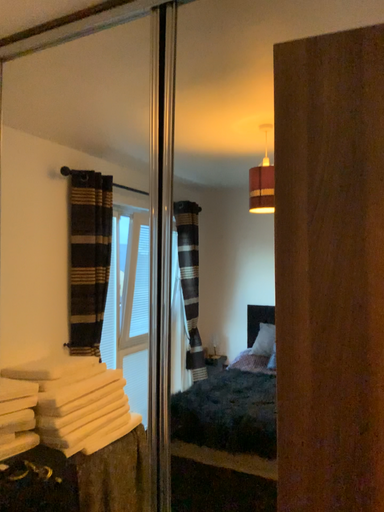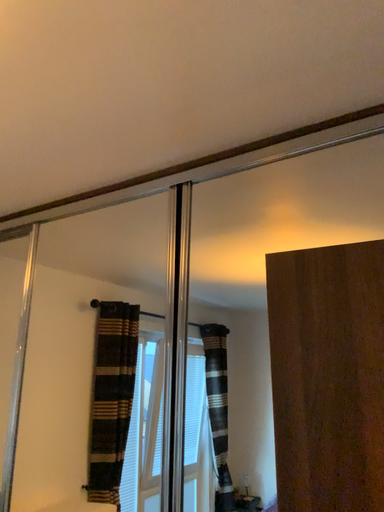
Question: Which way did the camera rotate in the video?

Choices:
 (A) rotated upward
 (B) rotated downward

Answer: (A)